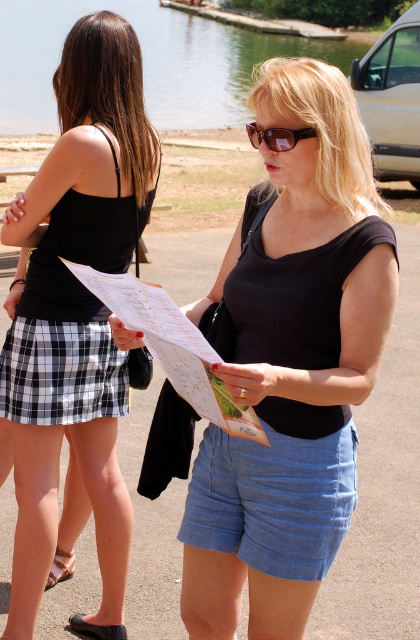
You are standing at point (x=278, y=129) and want to walk towards the person holding the map. Which direction should you move in relation to point (x=212, y=440)?

To reach the person holding the map, you should move towards point (x=212, y=440) since it is closer to you than point (x=278, y=129).

You are a photographer trying to capture a clear shot of the black matte shirt at center and sunglasses at center. Which object should you focus on first if you want to ensure both are in focus?

The black matte shirt at center is positioned under sunglasses at center, so focusing on the sunglasses at center first would ensure both are in focus since it is closer to the camera.